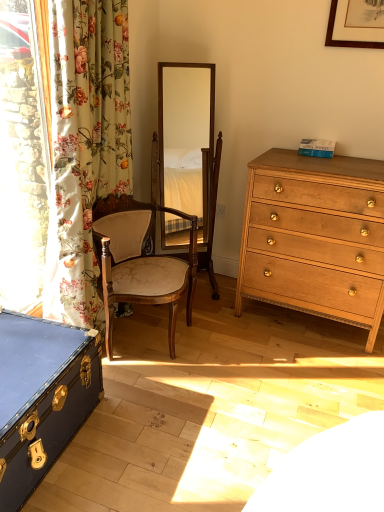
Locate an element on the screen. The height and width of the screenshot is (512, 384). free space between wooden swivel chair at center and wooden upholstered chair at center is located at coordinates [211, 311].